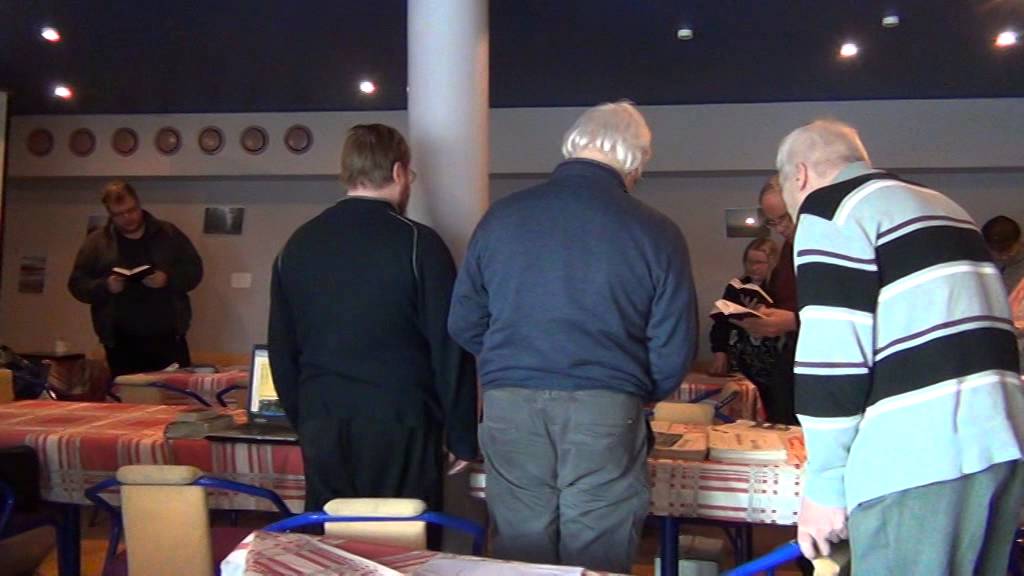
You are a GUI agent. You are given a task and a screenshot of the screen. Output one action in this format:
    pyautogui.click(x=<x>, y=<y>)
    Task: Click on the chairs
    Image resolution: width=1024 pixels, height=576 pixels.
    Given the screenshot: What is the action you would take?
    pyautogui.click(x=176, y=516), pyautogui.click(x=401, y=520), pyautogui.click(x=776, y=553), pyautogui.click(x=13, y=503), pyautogui.click(x=146, y=394), pyautogui.click(x=234, y=393), pyautogui.click(x=691, y=401), pyautogui.click(x=699, y=416), pyautogui.click(x=3, y=388)